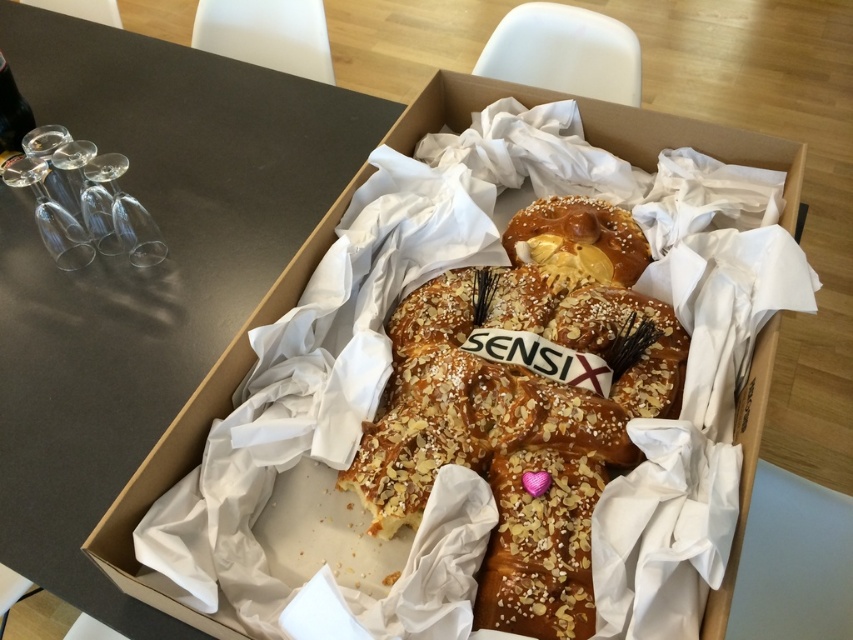
You need to place a small decorative item on the smooth gray table at center without covering the golden glazed pastry at center. Is there enough space on the table?

The smooth gray table at center is larger in size than the golden glazed pastry at center, so there is enough space to place the small decorative item without covering the pastry.

You are setting up a dinner table and need to place a centerpiece. The smooth gray table at center is where you will place it. Considering the transparent glass wine glass at left is already on the table, can the centerpiece be placed without moving the wine glass?

The smooth gray table at center has a larger size compared to the transparent glass wine glass at left, so there is enough space to place the centerpiece without moving the wine glass.